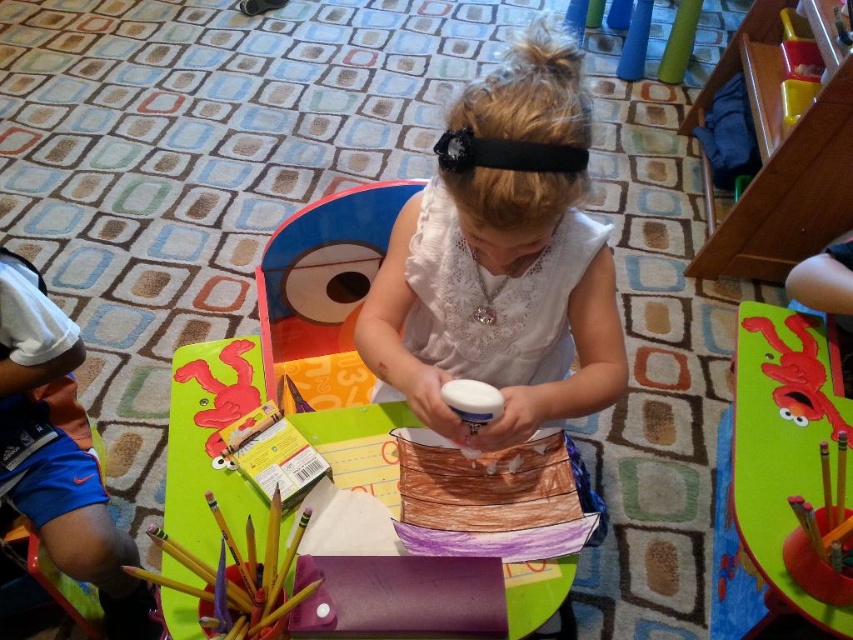
Question: Is wooden table at center positioned in front of green matte board at center?

Choices:
 (A) no
 (B) yes

Answer: (B)

Question: Which point is farther from the camera taking this photo?

Choices:
 (A) (363, 451)
 (B) (397, 304)
 (C) (750, 337)
 (D) (309, 385)

Answer: (D)

Question: Which of the following is the farthest from the observer?

Choices:
 (A) white lace dress at center
 (B) wooden table at center
 (C) matte plastic toy at center
 (D) green matte board at center

Answer: (C)

Question: Does wooden table at center lie behind chocolate cake at center?

Choices:
 (A) no
 (B) yes

Answer: (A)

Question: Can you confirm if wooden table at center is positioned to the left of green matte board at center?

Choices:
 (A) yes
 (B) no

Answer: (A)

Question: Which point is closer to the camera taking this photo?

Choices:
 (A) (477, 202)
 (B) (291, 282)

Answer: (A)